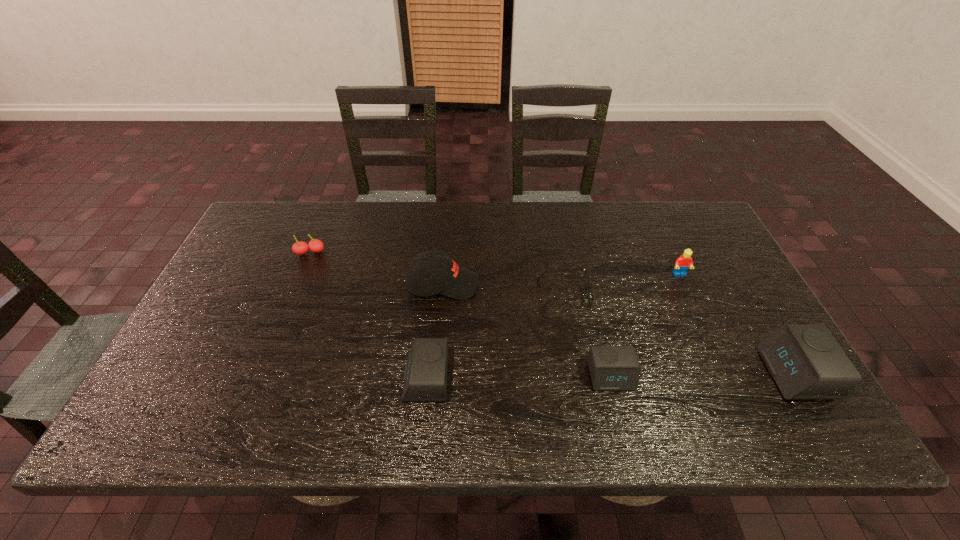
The image size is (960, 540). Find the location of `free space located on the front-facing side of the second shortest alarm clock`. free space located on the front-facing side of the second shortest alarm clock is located at coordinates (271, 379).

Locate an element on the screen. free space located 0.180m on the front-facing side of the second shortest alarm clock is located at coordinates pyautogui.click(x=326, y=379).

Locate an element on the screen. This screenshot has width=960, height=540. free space located 0.070m on the front-facing side of the rightmost alarm clock is located at coordinates (739, 373).

At what (x,y) coordinates should I click in order to perform the action: click on vacant space located 0.230m on the front-facing side of the rightmost alarm clock. Please return your answer as a coordinate pair (x, y). Looking at the image, I should click on (671, 373).

You are a GUI agent. You are given a task and a screenshot of the screen. Output one action in this format:
    pyautogui.click(x=<x>, y=<y>)
    Task: Click on the vacant space located 0.280m on the front-facing side of the rightmost alarm clock
    This screenshot has height=540, width=960.
    Given the screenshot: What is the action you would take?
    pyautogui.click(x=649, y=373)

You are a GUI agent. You are given a task and a screenshot of the screen. Output one action in this format:
    pyautogui.click(x=<x>, y=<y>)
    Task: Click on the vacant region located on the right of the cherry
    This screenshot has height=540, width=960.
    Given the screenshot: What is the action you would take?
    pyautogui.click(x=442, y=253)

Where is `vacant area located 0.330m with the lenses facing outward on the shortest object`? vacant area located 0.330m with the lenses facing outward on the shortest object is located at coordinates (419, 294).

Locate an element on the screen. vacant space situated with the lenses facing outward on the shortest object is located at coordinates (407, 294).

Where is `free location located with the lenses facing outward on the shortest object`? Image resolution: width=960 pixels, height=540 pixels. free location located with the lenses facing outward on the shortest object is located at coordinates (415, 294).

Image resolution: width=960 pixels, height=540 pixels. Find the location of `free region located 0.310m on the front-facing side of the baseball cap`. free region located 0.310m on the front-facing side of the baseball cap is located at coordinates (589, 285).